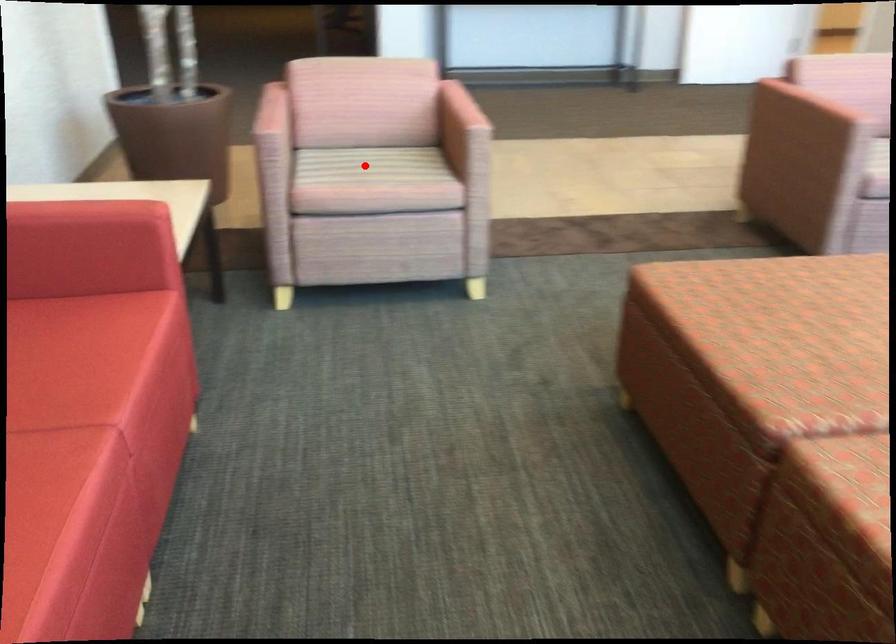
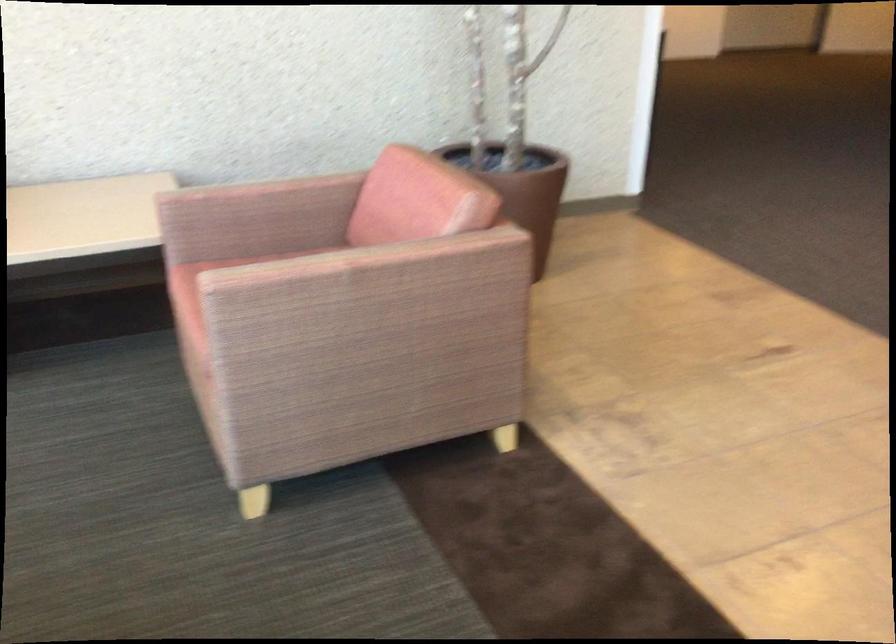
Question: I am providing you with two images of the same scene from different viewpoints. A red point is marked on the first image. At the location where the point appears in image 1, is it still visible in image 2?

Choices:
 (A) Yes
 (B) No

Answer: (B)